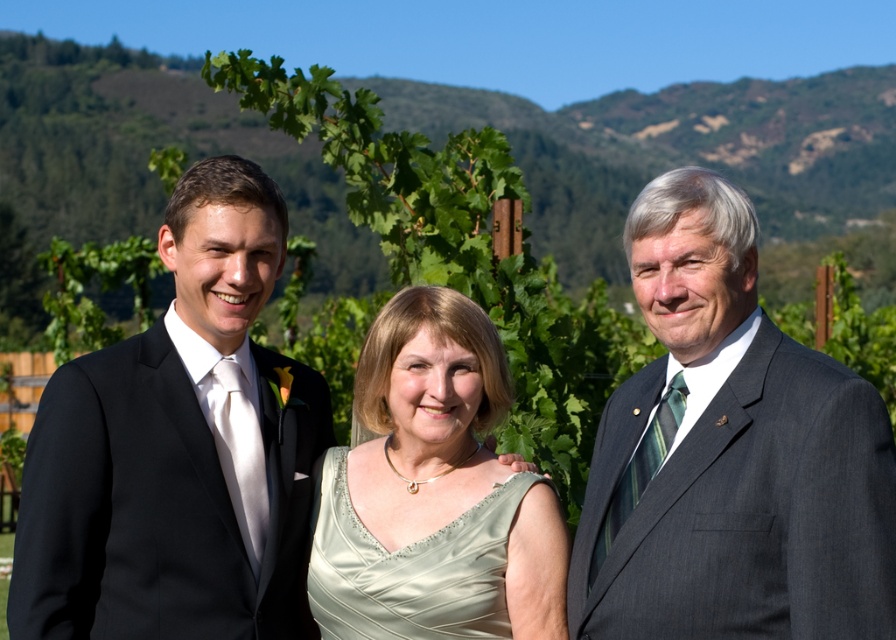
Can you confirm if dark gray suit at right is thinner than satin dress at center?

Indeed, dark gray suit at right has a lesser width compared to satin dress at center.

Consider the image. Is dark gray suit at right positioned behind satin dress at center?

No, dark gray suit at right is closer to the viewer.

Which is behind, point (804, 628) or point (314, 556)?

Point (314, 556)

At what (x,y) coordinates should I click in order to perform the action: click on dark gray suit at right. Please return your answer as a coordinate pair (x, y). The height and width of the screenshot is (640, 896). Looking at the image, I should click on (x=729, y=454).

Consider the image. Is black satin suit at left below satin green dress at center?

Incorrect, black satin suit at left is not positioned below satin green dress at center.

Who is taller, black satin suit at left or satin green dress at center?

Result: black satin suit at left

The image size is (896, 640). Describe the element at coordinates (178, 449) in the screenshot. I see `black satin suit at left` at that location.

This screenshot has height=640, width=896. Identify the location of black satin suit at left. (178, 449).

Which is above, satin dress at center or satin green dress at center?

satin dress at center is higher up.

Does point (418, 346) come in front of point (366, 596)?

No, (418, 346) is behind (366, 596).

Locate an element on the screen. This screenshot has height=640, width=896. satin dress at center is located at coordinates (433, 492).